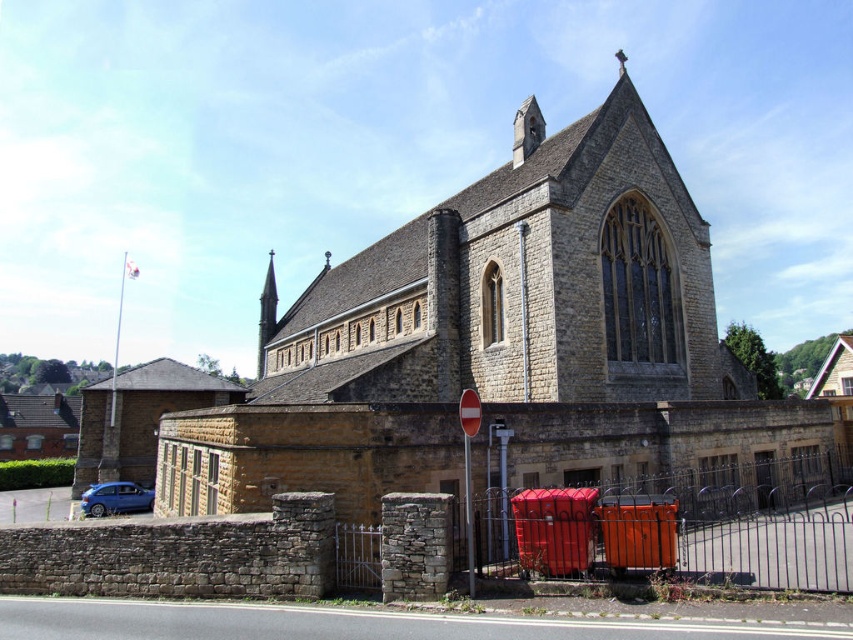
You are a delivery driver who needs to park your metallic blue hatchback at lower left close to the stone church at center without blocking the entrance. Based on their widths, can you safely park the hatchback next to the church?

The stone church at center might be wider than metallic blue hatchback at lower left, so there may be enough space to park the metallic blue hatchback at lower left next to the church without blocking the entrance.

You are driving a car that is 4.5 meters long and need to park it between the stone church at center and the metallic blue hatchback at lower left. The parking space available is exactly 32.82 meters long. Can your car fit in this space without overlapping either vehicle?

The distance between the stone church at center and the metallic blue hatchback at lower left is 32.82 meters. Since your car is only 4.5 meters long, there is more than enough space to park it in the available parking space without overlapping either vehicle.